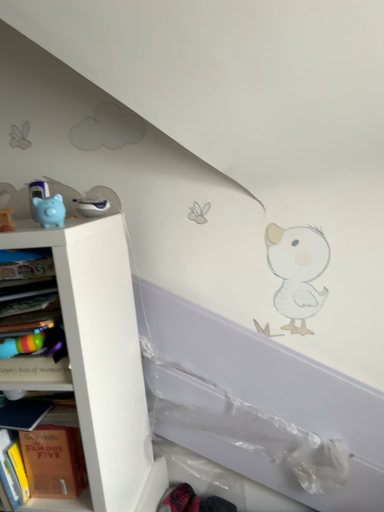
Image resolution: width=384 pixels, height=512 pixels. Describe the element at coordinates (101, 358) in the screenshot. I see `white matte shelf at left, which is the 1th shelf in bottom-to-top order` at that location.

The image size is (384, 512). In order to click on hardcover book at left, the second shelf from the bottom in this screenshot , I will do point(54,454).

Identify the location of multicolored plastic bookshelf at left. This screenshot has height=512, width=384. (35, 374).

Is multicolored plastic bookshelf at left not near hardcover book at left, the first shelf viewed from the top?

Actually, multicolored plastic bookshelf at left and hardcover book at left, the first shelf viewed from the top, are a little close together.

From the picture: Considering the relative sizes of multicolored plastic bookshelf at left and hardcover book at left, the first shelf viewed from the top, in the image provided, is multicolored plastic bookshelf at left smaller than hardcover book at left, the first shelf viewed from the top,?

No, multicolored plastic bookshelf at left is not smaller than hardcover book at left, the first shelf viewed from the top.

From the image's perspective, between multicolored plastic bookshelf at left and hardcover book at left, the first shelf viewed from the top, who is located below?

From the image's view, hardcover book at left, the first shelf viewed from the top, is below.

Is multicolored plastic bookshelf at left facing towards hardcover book at left, the first shelf viewed from the top?

No, multicolored plastic bookshelf at left is not aimed at hardcover book at left, the first shelf viewed from the top.

How far apart are white matte shelf at left, which appears as the second shelf when viewed from the top, and hardcover book at left, the second shelf from the bottom?

The distance of white matte shelf at left, which appears as the second shelf when viewed from the top, from hardcover book at left, the second shelf from the bottom, is 19.30 centimeters.

What's the angular difference between white matte shelf at left, which appears as the second shelf when viewed from the top, and hardcover book at left, the first shelf viewed from the top,'s facing directions?

The facing directions of white matte shelf at left, which appears as the second shelf when viewed from the top, and hardcover book at left, the first shelf viewed from the top, are 2.14 degrees apart.

Are white matte shelf at left, which is the 1th shelf in bottom-to-top order, and hardcover book at left, the second shelf from the bottom, located far from each other?

white matte shelf at left, which is the 1th shelf in bottom-to-top order, is actually quite close to hardcover book at left, the second shelf from the bottom.

Is white matte shelf at left, which is the 1th shelf in bottom-to-top order, turned away from hardcover book at left, the first shelf viewed from the top?

Yes.

From the image's perspective, is white matte shelf at left, which appears as the second shelf when viewed from the top, on blue rubber piggy bank at left?

No, from the image's perspective, white matte shelf at left, which appears as the second shelf when viewed from the top, is not above blue rubber piggy bank at left.

The height and width of the screenshot is (512, 384). In the image, there is a white matte shelf at left, which is the 1th shelf in bottom-to-top order. Find the location of `toy above it (from the image's perspective)`. toy above it (from the image's perspective) is located at coordinates (48, 211).

Considering the relative sizes of white matte shelf at left, which appears as the second shelf when viewed from the top, and blue rubber piggy bank at left in the image provided, is white matte shelf at left, which appears as the second shelf when viewed from the top, smaller than blue rubber piggy bank at left?

No.

Considering the relative sizes of multicolored plastic bookshelf at left and white matte shelf at left, which appears as the second shelf when viewed from the top, in the image provided, is multicolored plastic bookshelf at left wider than white matte shelf at left, which appears as the second shelf when viewed from the top,?

No, multicolored plastic bookshelf at left is not wider than white matte shelf at left, which appears as the second shelf when viewed from the top.

Is multicolored plastic bookshelf at left further to the viewer compared to white matte shelf at left, which appears as the second shelf when viewed from the top?

No, multicolored plastic bookshelf at left is closer to the camera.

Is multicolored plastic bookshelf at left not inside white matte shelf at left, which is the 1th shelf in bottom-to-top order?

No, multicolored plastic bookshelf at left is inside white matte shelf at left, which is the 1th shelf in bottom-to-top order,'s boundary.

Can you confirm if multicolored plastic bookshelf at left is shorter than white matte shelf at left, which is the 1th shelf in bottom-to-top order?

Indeed, multicolored plastic bookshelf at left has a lesser height compared to white matte shelf at left, which is the 1th shelf in bottom-to-top order.

Can you confirm if white matte shelf at left, which is the 1th shelf in bottom-to-top order, is taller than multicolored plastic bookshelf at left?

Indeed, white matte shelf at left, which is the 1th shelf in bottom-to-top order, has a greater height compared to multicolored plastic bookshelf at left.

Does white matte shelf at left, which appears as the second shelf when viewed from the top, lie in front of multicolored plastic bookshelf at left?

No, the depth of white matte shelf at left, which appears as the second shelf when viewed from the top, is greater than that of multicolored plastic bookshelf at left.

Based on the photo, is white matte shelf at left, which appears as the second shelf when viewed from the top, far away from multicolored plastic bookshelf at left?

No.

Considering the sizes of objects white matte shelf at left, which appears as the second shelf when viewed from the top, and multicolored plastic bookshelf at left in the image provided, who is wider, white matte shelf at left, which appears as the second shelf when viewed from the top, or multicolored plastic bookshelf at left?

white matte shelf at left, which appears as the second shelf when viewed from the top, is wider.

Is multicolored plastic bookshelf at left outside of blue rubber piggy bank at left?

That's correct, multicolored plastic bookshelf at left is outside of blue rubber piggy bank at left.

From the image's perspective, which is below, multicolored plastic bookshelf at left or blue rubber piggy bank at left?

multicolored plastic bookshelf at left is shown below in the image.

Between multicolored plastic bookshelf at left and blue rubber piggy bank at left, which one has smaller width?

Thinner between the two is blue rubber piggy bank at left.

Is point (22, 435) positioned before point (123, 424)?

Yes, it is.

Locate an element on the screen. shelf in front of the hardcover book at left, the second shelf from the bottom is located at coordinates (101, 358).

Would you consider hardcover book at left, the second shelf from the bottom, to be distant from white matte shelf at left, which appears as the second shelf when viewed from the top?

No, hardcover book at left, the second shelf from the bottom, is not far away from white matte shelf at left, which appears as the second shelf when viewed from the top.

Between hardcover book at left, the second shelf from the bottom, and white matte shelf at left, which is the 1th shelf in bottom-to-top order, which one has more height?

With more height is white matte shelf at left, which is the 1th shelf in bottom-to-top order.

I want to click on shelf on the right of multicolored plastic bookshelf at left, so click(54, 454).

Image resolution: width=384 pixels, height=512 pixels. In order to click on shelf behind the white matte shelf at left, which is the 1th shelf in bottom-to-top order in this screenshot , I will do `click(54, 454)`.

From the image, which object appears to be nearer to blue rubber piggy bank at left, hardcover book at left, the first shelf viewed from the top, or white matte shelf at left, which is the 1th shelf in bottom-to-top order?

Based on the image, white matte shelf at left, which is the 1th shelf in bottom-to-top order, appears to be nearer to blue rubber piggy bank at left.

When comparing their distances from hardcover book at left, the second shelf from the bottom, does white matte shelf at left, which appears as the second shelf when viewed from the top, or blue rubber piggy bank at left seem further?

blue rubber piggy bank at left lies further to hardcover book at left, the second shelf from the bottom, than the other object.

When comparing their distances from multicolored plastic bookshelf at left, does blue rubber piggy bank at left or white matte shelf at left, which is the 1th shelf in bottom-to-top order, seem closer?

white matte shelf at left, which is the 1th shelf in bottom-to-top order, lies closer to multicolored plastic bookshelf at left than the other object.

Looking at the image, which one is located closer to multicolored plastic bookshelf at left, white matte shelf at left, which appears as the second shelf when viewed from the top, or blue rubber piggy bank at left?

The object closer to multicolored plastic bookshelf at left is white matte shelf at left, which appears as the second shelf when viewed from the top.

Based on their spatial positions, is white matte shelf at left, which appears as the second shelf when viewed from the top, or multicolored plastic bookshelf at left further from blue rubber piggy bank at left?

white matte shelf at left, which appears as the second shelf when viewed from the top.

From the image, which object appears to be nearer to multicolored plastic bookshelf at left, blue rubber piggy bank at left or hardcover book at left, the first shelf viewed from the top?

The object closer to multicolored plastic bookshelf at left is hardcover book at left, the first shelf viewed from the top.

When comparing their distances from blue rubber piggy bank at left, does multicolored plastic bookshelf at left or hardcover book at left, the second shelf from the bottom, seem closer?

The object closer to blue rubber piggy bank at left is multicolored plastic bookshelf at left.

Looking at the image, which one is located further to white matte shelf at left, which appears as the second shelf when viewed from the top, multicolored plastic bookshelf at left or blue rubber piggy bank at left?

blue rubber piggy bank at left lies further to white matte shelf at left, which appears as the second shelf when viewed from the top, than the other object.

This screenshot has width=384, height=512. In order to click on shelf between blue rubber piggy bank at left and white matte shelf at left, which appears as the second shelf when viewed from the top, in the up-down direction in this screenshot , I will do `click(54, 454)`.

Identify the location of book between blue rubber piggy bank at left and white matte shelf at left, which appears as the second shelf when viewed from the top, in the up-down direction. (35, 374).

Locate an element on the screen. This screenshot has height=512, width=384. book between blue rubber piggy bank at left and hardcover book at left, the second shelf from the bottom, in the up-down direction is located at coordinates (35, 374).

At what (x,y) coordinates should I click in order to perform the action: click on shelf that lies between multicolored plastic bookshelf at left and white matte shelf at left, which is the 1th shelf in bottom-to-top order, from top to bottom. Please return your answer as a coordinate pair (x, y). The height and width of the screenshot is (512, 384). Looking at the image, I should click on (54, 454).